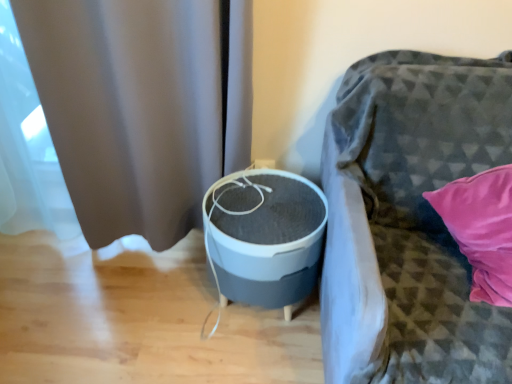
Question: Is gray matte curtain at left to the left or to the right of gray matte/soft fabric round table at center in the image?

Choices:
 (A) right
 (B) left

Answer: (B)

Question: Relative to gray matte/soft fabric round table at center, is gray matte curtain at left in front or behind?

Choices:
 (A) front
 (B) behind

Answer: (A)

Question: Which of these objects is positioned closest to the textured gray fabric couch at right?

Choices:
 (A) gray matte/soft fabric round table at center
 (B) gray matte curtain at left

Answer: (A)

Question: Based on their relative distances, which object is nearer to the gray matte/soft fabric round table at center?

Choices:
 (A) textured gray fabric couch at right
 (B) gray matte curtain at left

Answer: (A)